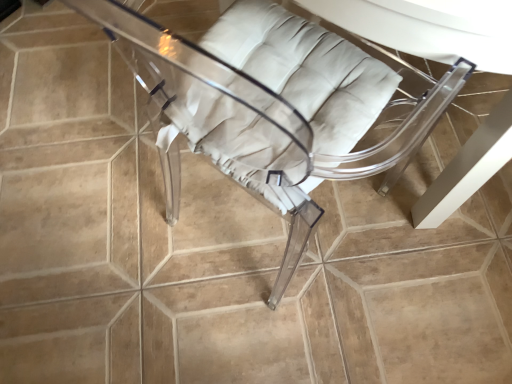
The image size is (512, 384). In order to click on vacant position to the left of clear acrylic chair at center in this screenshot , I will do `click(109, 221)`.